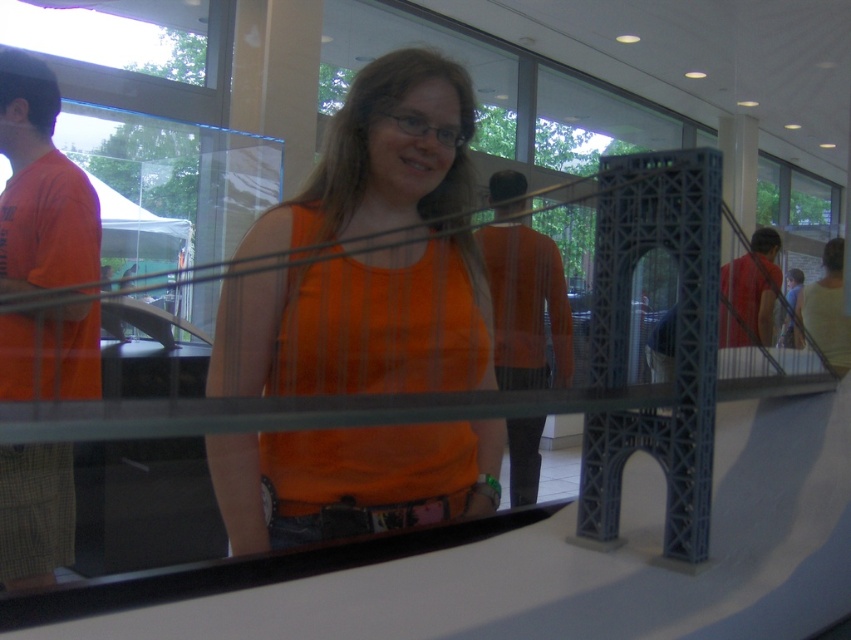
You are standing in the modern building described and want to place a small plant exactly at the coordinates where the orange fabric shirt at center is located. Is this possible, considering the shirt is part of a person?

The orange fabric shirt at center is located at point (524, 292), but since it is part of a person standing there, placing a plant at those coordinates would require the person to move first.

You are a photographer trying to capture a clear shot of the orange fabric shirt at center and the matte red shirt at center. Which one is positioned higher in the frame?

The orange fabric shirt at center is located above the matte red shirt at center, so it is positioned higher in the frame.